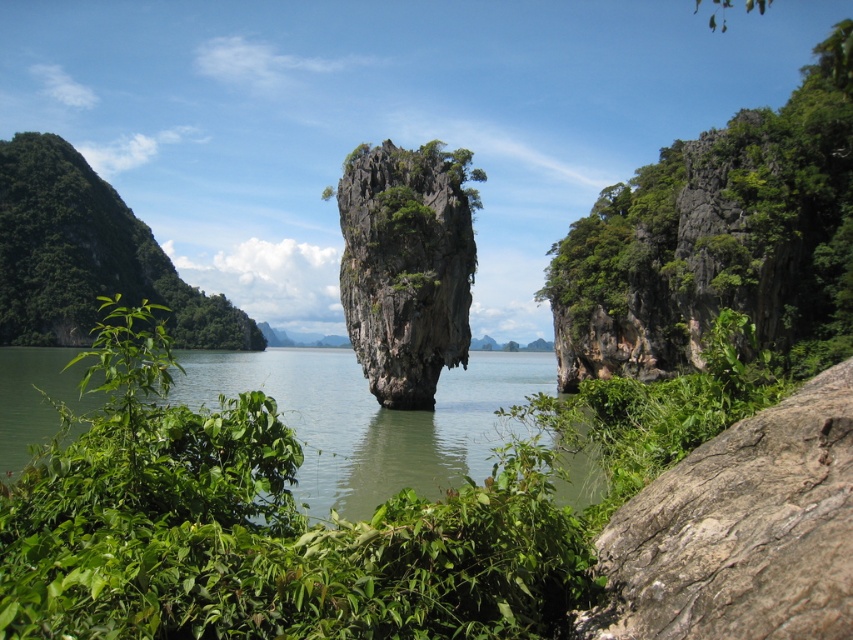
You are a hiker who wants to cross between the green leafy rock at right and the green leafy shrub at left. Which one has a narrower width?

The green leafy rock at right has a narrower width than the green leafy shrub at left.

You are a hiker who wants to climb the highest rock in the scene. Which rock should you choose between the gray rough rock at center and the green mossy rock at center?

The green mossy rock at center is taller than the gray rough rock at center, so you should choose the green mossy rock at center for climbing.